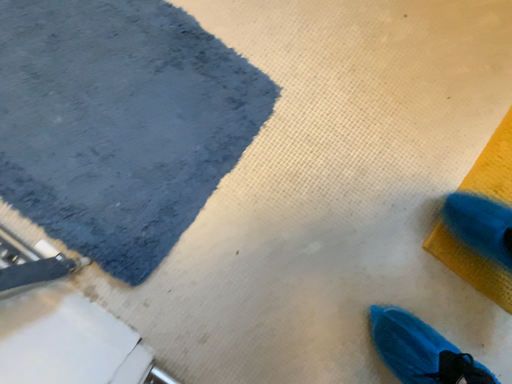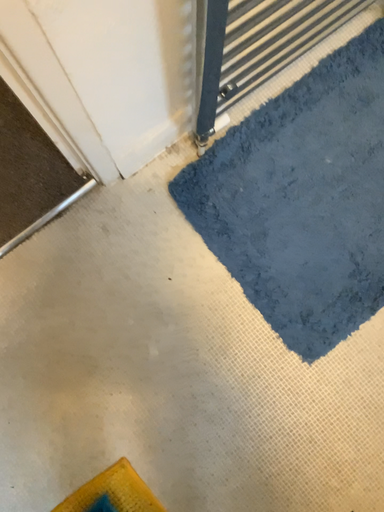
Question: Which way did the camera rotate in the video?

Choices:
 (A) rotated upward
 (B) rotated downward

Answer: (A)